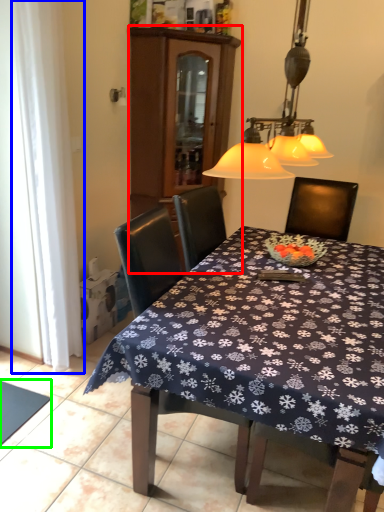
Question: Which is farther away from cabinetry (highlighted by a red box)? curtain (highlighted by a blue box) or tablecloth (highlighted by a green box)?

Choices:
 (A) curtain
 (B) tablecloth

Answer: (B)